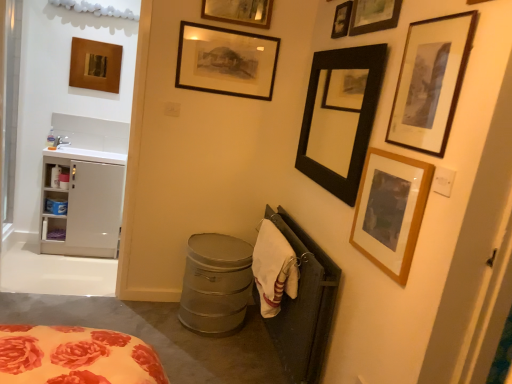
At what (x,y) coordinates should I click in order to perform the action: click on vacant region to the left of metallic gray trash can at lower center. Please return your answer as a coordinate pair (x, y). The height and width of the screenshot is (384, 512). Looking at the image, I should click on coord(144,317).